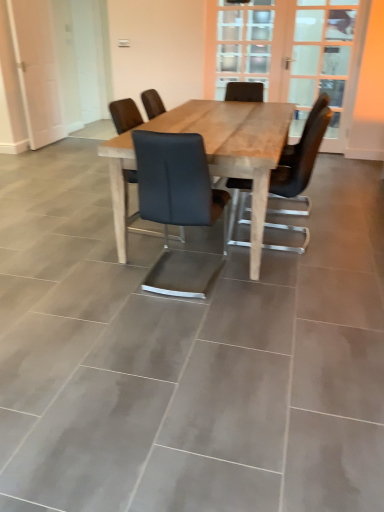
Find the location of `free spot behind black leather chair at center, the second chair in the right-to-left sequence`. free spot behind black leather chair at center, the second chair in the right-to-left sequence is located at coordinates (192, 241).